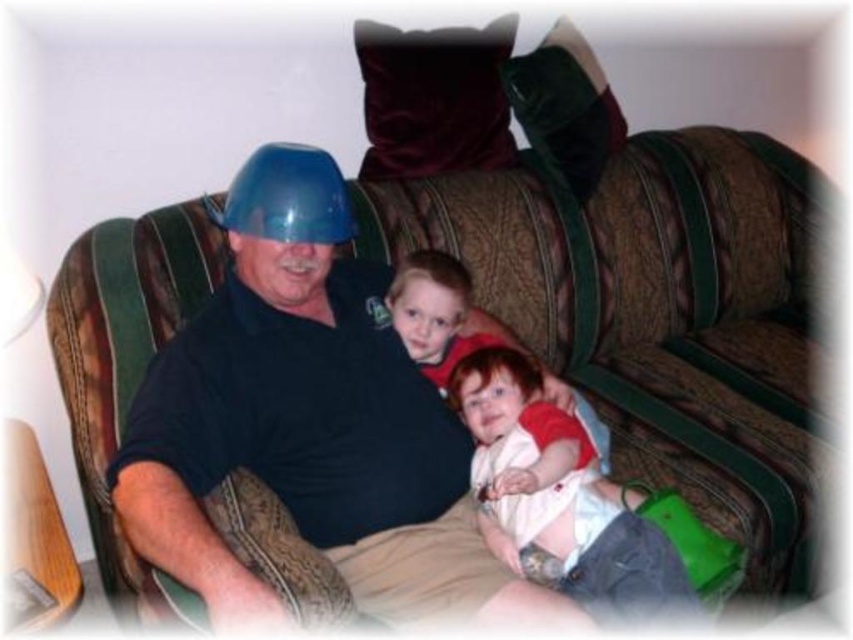
You are standing at the origin point of the coordinate system. You see two points in the image, point (666, 429) and point (596, 496). Which point is closer to you?

Point (596, 496) is closer to you because it is in front of point (666, 429).

You are trying to decide whether to place a new decorative item on the brown fabric couch at center or the blue plastic helmet at center. The item is 1.2 meters wide. Which object can fit the item based on their widths?

The brown fabric couch at center has a greater width than the blue plastic helmet at center, so the item can fit on the brown fabric couch at center.